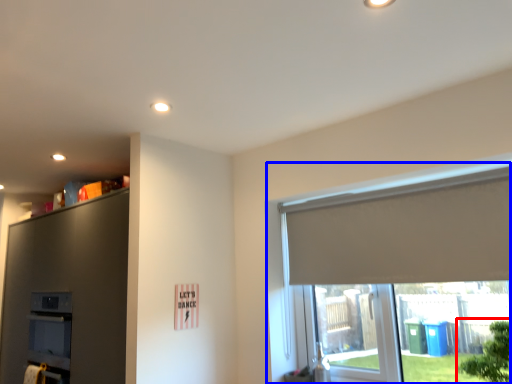
Question: Which object is closer to the camera taking this photo, tree (highlighted by a red box) or window (highlighted by a blue box)?

Choices:
 (A) tree
 (B) window

Answer: (A)